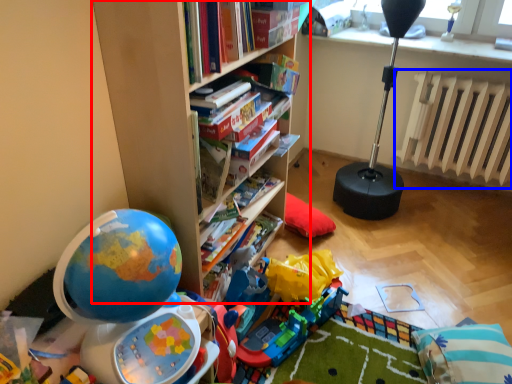
Question: Which object is closer to the camera taking this photo, bookcase (highlighted by a red box) or radiator (highlighted by a blue box)?

Choices:
 (A) bookcase
 (B) radiator

Answer: (A)